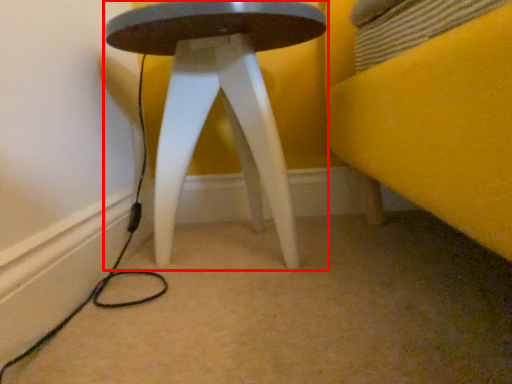
Question: From the image's perspective, considering the relative positions of stool (annotated by the red box) and cable in the image provided, where is stool (annotated by the red box) located with respect to the staircase?

Choices:
 (A) below
 (B) above

Answer: (B)